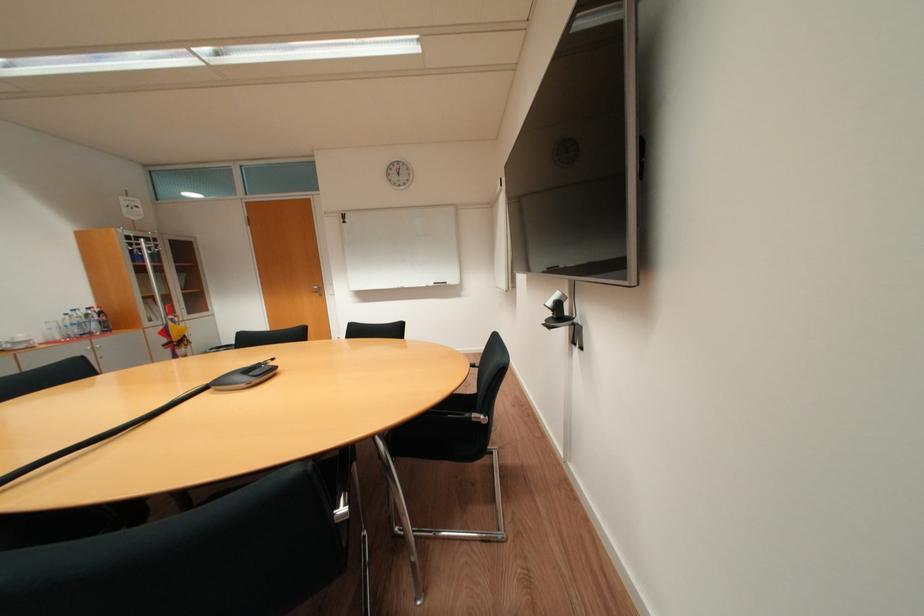
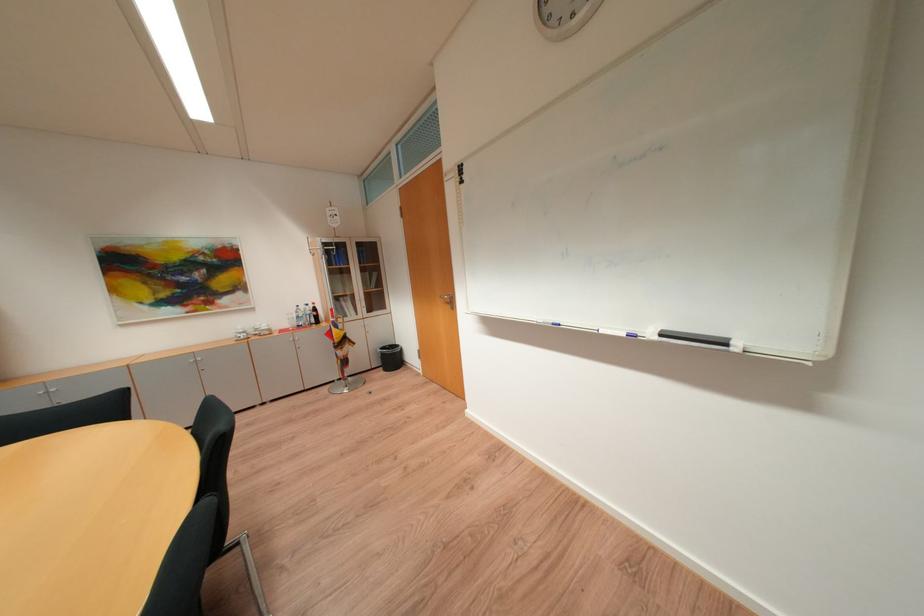
Find the pixel in the second image that matches [174,334] in the first image.

(338, 334)